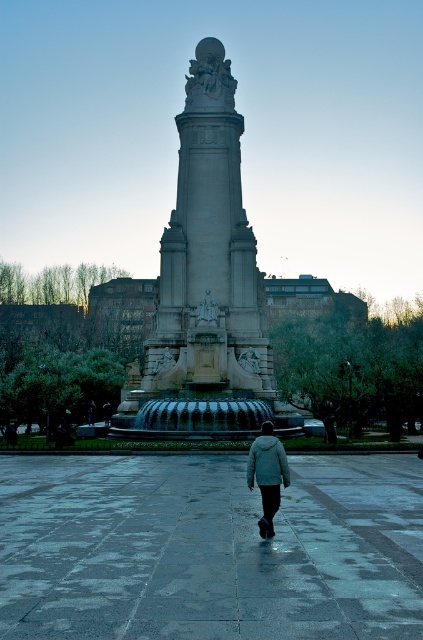
Question: Which point is farther from the camera taking this photo?

Choices:
 (A) (244, 221)
 (B) (271, 436)

Answer: (A)

Question: Which point is farther to the camera?

Choices:
 (A) light gray woolen jacket at center
 (B) gray stone monument at center
 (C) green matte jacket at lower center

Answer: (B)

Question: Is gray stone monument at center above green matte jacket at lower center?

Choices:
 (A) no
 (B) yes

Answer: (B)

Question: Is light gray woolen jacket at center behind green matte jacket at lower center?

Choices:
 (A) no
 (B) yes

Answer: (A)

Question: Can you confirm if gray stone monument at center is positioned to the left of light gray woolen jacket at center?

Choices:
 (A) no
 (B) yes

Answer: (B)

Question: Based on their relative distances, which object is nearer to the gray stone monument at center?

Choices:
 (A) green matte jacket at lower center
 (B) light gray woolen jacket at center

Answer: (B)